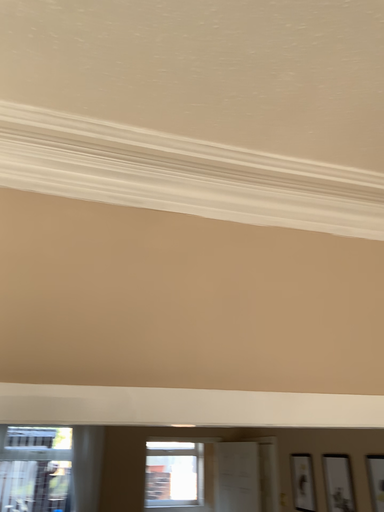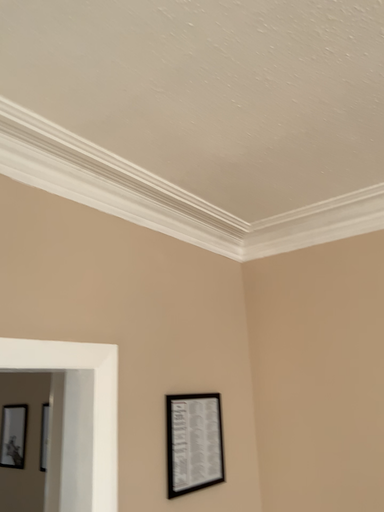
Question: How did the camera likely rotate when shooting the video?

Choices:
 (A) rotated right
 (B) rotated left

Answer: (A)